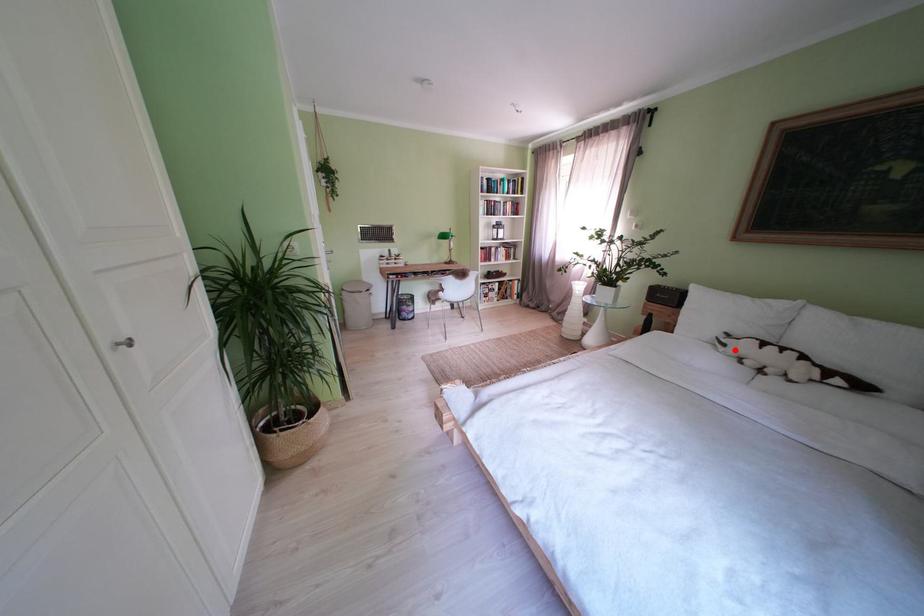
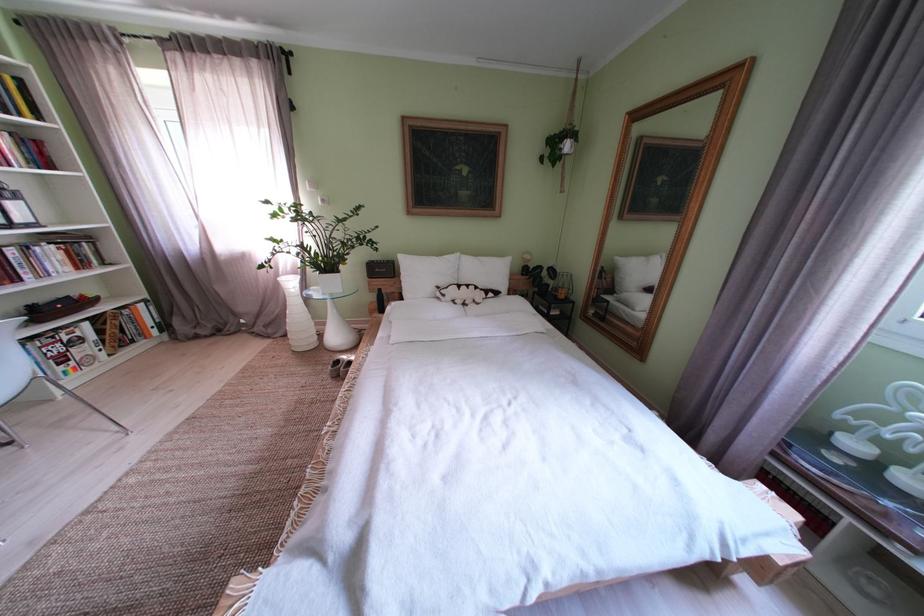
In the second image, find the point that corresponds to the highlighted location in the first image.

(455, 301)